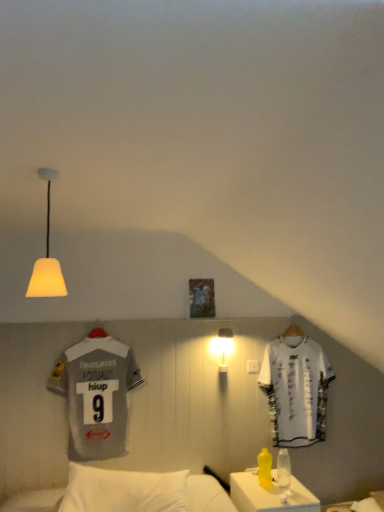
Question: In the image, is white plastic table at lower right positioned in front of or behind gray jersey at left, which appears as the second sports uniform when viewed from the right?

Choices:
 (A) front
 (B) behind

Answer: (A)

Question: From the image's perspective, is white plastic table at lower right above or below gray jersey at left, which is the 2th sports uniform from back to front?

Choices:
 (A) above
 (B) below

Answer: (B)

Question: Which object is the closest to the yellow translucent bottle at lower right, the second bottle positioned from the left?

Choices:
 (A) white matte lampshade at upper left, arranged as the second lamp when ordered from the bottom
 (B) yellow matte bottle at lower right, acting as the second bottle starting from the right
 (C) gray jersey at left, the first sports uniform viewed from the left
 (D) white plastic table at lower right
 (E) white matte sports uniform at right, which is the first sports uniform from back to front

Answer: (B)

Question: Estimate the real-world distances between objects in this image. Which object is farther from the gray jersey at left, which appears as the second sports uniform when viewed from the right?

Choices:
 (A) yellow matte bottle at lower right, acting as the second bottle starting from the right
 (B) white matte lampshade at upper left, arranged as the second lamp when ordered from the bottom
 (C) white plastic table at lower right
 (D) white frosted glass wall lamp at center, the 1th lamp when ordered from bottom to top
 (E) yellow translucent bottle at lower right, the second bottle positioned from the left

Answer: (B)